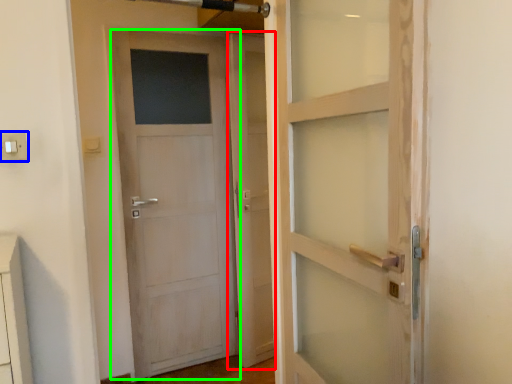
Question: Based on their relative distances, which object is nearer to screen door (highlighted by a red box)? Choose from electric outlet (highlighted by a blue box) and door (highlighted by a green box).

Choices:
 (A) electric outlet
 (B) door

Answer: (B)